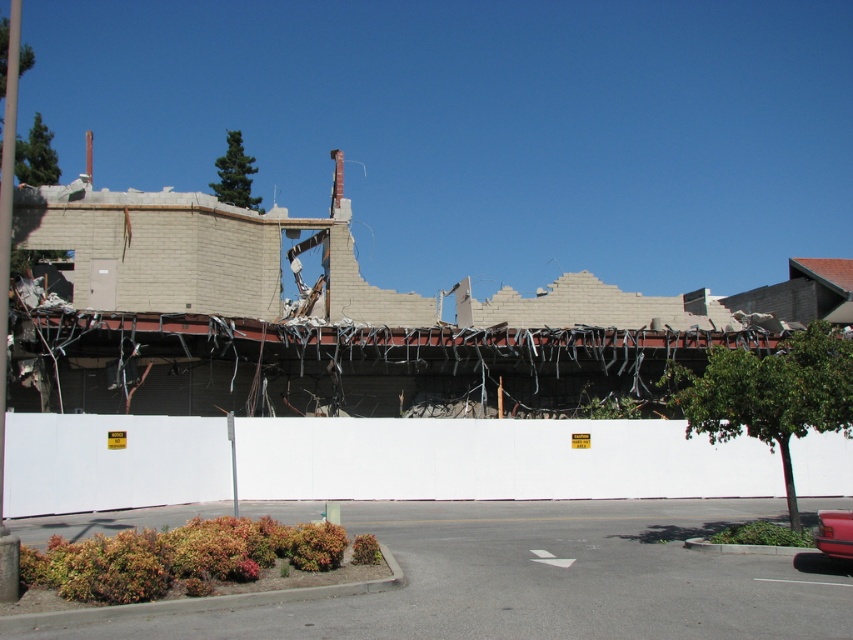
Question: Does white plastic fence at center appear on the right side of metallic red car at lower right?

Choices:
 (A) no
 (B) yes

Answer: (A)

Question: Can you confirm if white plastic fence at center is thinner than metallic red car at lower right?

Choices:
 (A) yes
 (B) no

Answer: (B)

Question: Which of the following is the farthest from the observer?

Choices:
 (A) white plastic fence at center
 (B) metallic red car at lower right

Answer: (A)

Question: Which point is closer to the camera?

Choices:
 (A) (405, 445)
 (B) (827, 532)

Answer: (B)

Question: Does white plastic fence at center have a greater width compared to metallic red car at lower right?

Choices:
 (A) yes
 (B) no

Answer: (A)